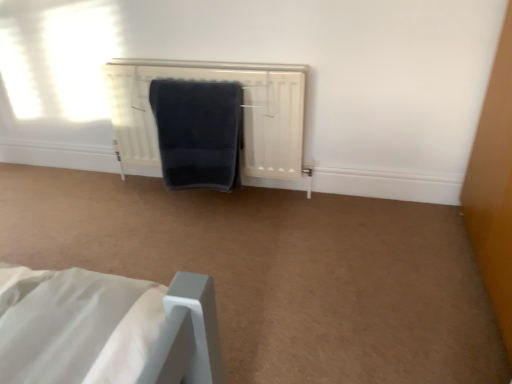
Find the location of a particular element. dark blue textured towel at center is located at coordinates (198, 132).

Image resolution: width=512 pixels, height=384 pixels. Describe the element at coordinates (198, 132) in the screenshot. I see `dark blue textured towel at center` at that location.

Find the location of a particular element. white matte radiator at center is located at coordinates (243, 110).

Describe the element at coordinates (243, 110) in the screenshot. I see `white matte radiator at center` at that location.

In order to click on dark blue textured towel at center in this screenshot , I will do `click(198, 132)`.

Can you confirm if dark blue textured towel at center is positioned to the right of white matte radiator at center?

Incorrect, dark blue textured towel at center is not on the right side of white matte radiator at center.

Between dark blue textured towel at center and white matte radiator at center, which one is positioned in front?

dark blue textured towel at center is closer to the camera.

Does point (175, 98) lie in front of point (302, 84)?

No, it is behind (302, 84).

From the image's perspective, is dark blue textured towel at center above white matte radiator at center?

Incorrect, from the image's perspective, dark blue textured towel at center is lower than white matte radiator at center.

From a real-world perspective, is dark blue textured towel at center beneath white matte radiator at center?

No, from a real-world perspective, dark blue textured towel at center is not below white matte radiator at center.

Considering the sizes of objects dark blue textured towel at center and white matte radiator at center in the image provided, who is wider, dark blue textured towel at center or white matte radiator at center?

With larger width is white matte radiator at center.

Who is shorter, dark blue textured towel at center or white matte radiator at center?

dark blue textured towel at center.

Who is smaller, dark blue textured towel at center or white matte radiator at center?

dark blue textured towel at center is smaller.

Would you say dark blue textured towel at center is outside white matte radiator at center?

No, dark blue textured towel at center is inside or overlapping with white matte radiator at center.

Is dark blue textured towel at center touching white matte radiator at center?

No, dark blue textured towel at center is not touching white matte radiator at center.

Is dark blue textured towel at center facing away from white matte radiator at center?

Yes.

Measure the distance from dark blue textured towel at center to white matte radiator at center.

The distance of dark blue textured towel at center from white matte radiator at center is 6.48 inches.

You are a GUI agent. You are given a task and a screenshot of the screen. Output one action in this format:
    pyautogui.click(x=<x>, y=<y>)
    Task: Click on the radiator behind the dark blue textured towel at center
    Image resolution: width=512 pixels, height=384 pixels.
    Given the screenshot: What is the action you would take?
    pyautogui.click(x=243, y=110)

From the picture: In the image, is white matte radiator at center on the left side or the right side of dark blue textured towel at center?

In the image, white matte radiator at center appears on the right side of dark blue textured towel at center.

Does white matte radiator at center come in front of dark blue textured towel at center?

That is False.

Is point (249, 136) positioned behind point (169, 128)?

That is True.

From the image's perspective, which object appears higher, white matte radiator at center or dark blue textured towel at center?

white matte radiator at center, from the image's perspective.

From a real-world perspective, is white matte radiator at center above or below dark blue textured towel at center?

white matte radiator at center is situated lower than dark blue textured towel at center in the real world.

Looking at their sizes, would you say white matte radiator at center is wider or thinner than dark blue textured towel at center?

In the image, white matte radiator at center appears to be wider than dark blue textured towel at center.

Which of these two, white matte radiator at center or dark blue textured towel at center, stands shorter?

With less height is dark blue textured towel at center.

Is white matte radiator at center bigger or smaller than dark blue textured towel at center?

Clearly, white matte radiator at center is larger in size than dark blue textured towel at center.

Choose the correct answer: Is white matte radiator at center inside dark blue textured towel at center or outside it?

The correct answer is: outside.

Are white matte radiator at center and dark blue textured towel at center far apart?

No, white matte radiator at center is not far from dark blue textured towel at center.

Is white matte radiator at center facing towards dark blue textured towel at center?

Yes.

Identify the location of towel below the white matte radiator at center (from the image's perspective). The image size is (512, 384). 198,132.

At what (x,y) coordinates should I click in order to perform the action: click on radiator directly beneath the dark blue textured towel at center (from a real-world perspective). Please return your answer as a coordinate pair (x, y). Looking at the image, I should click on (243, 110).

At what (x,y) coordinates should I click in order to perform the action: click on towel on the left of white matte radiator at center. Please return your answer as a coordinate pair (x, y). Looking at the image, I should click on (198, 132).